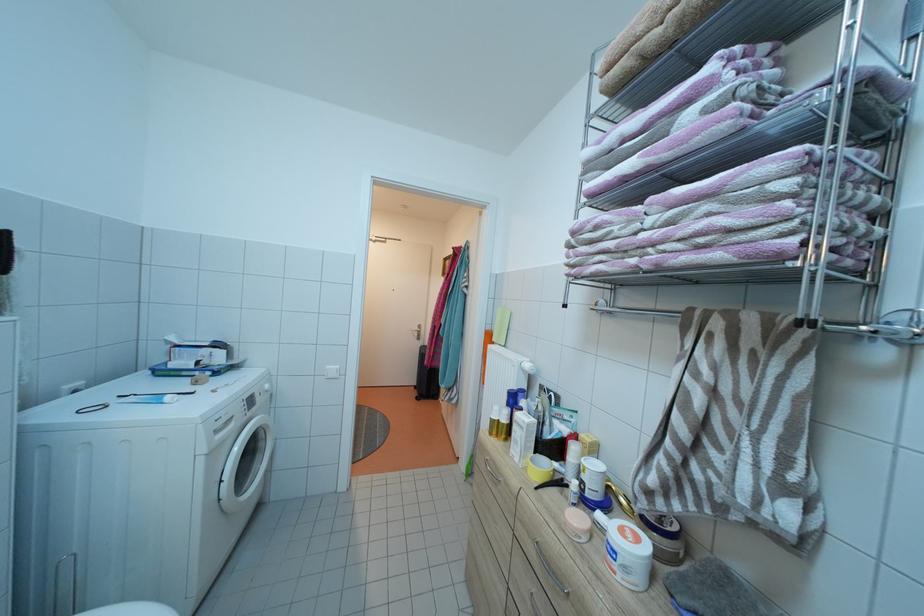
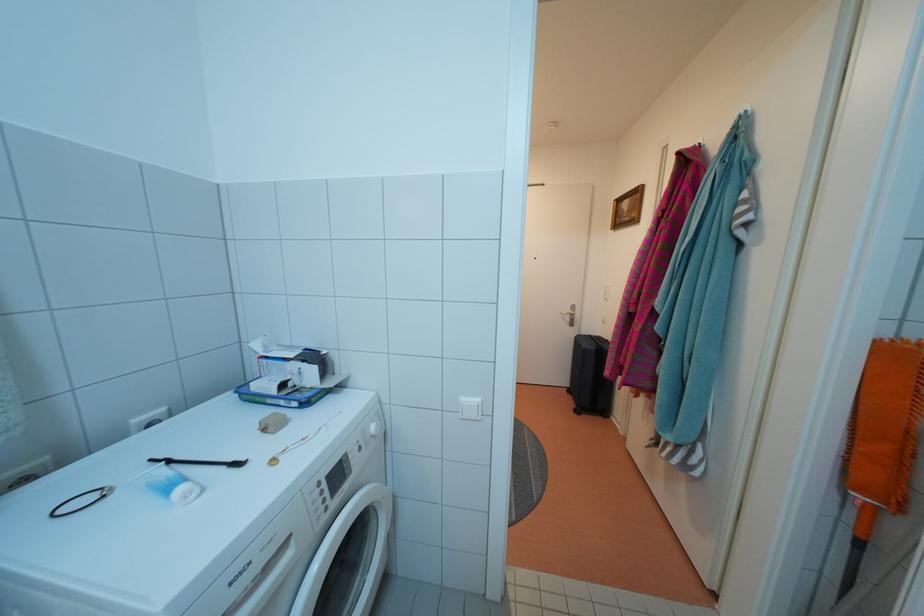
Find the pixel in the second image that matches point (274, 392) in the first image.

(380, 434)